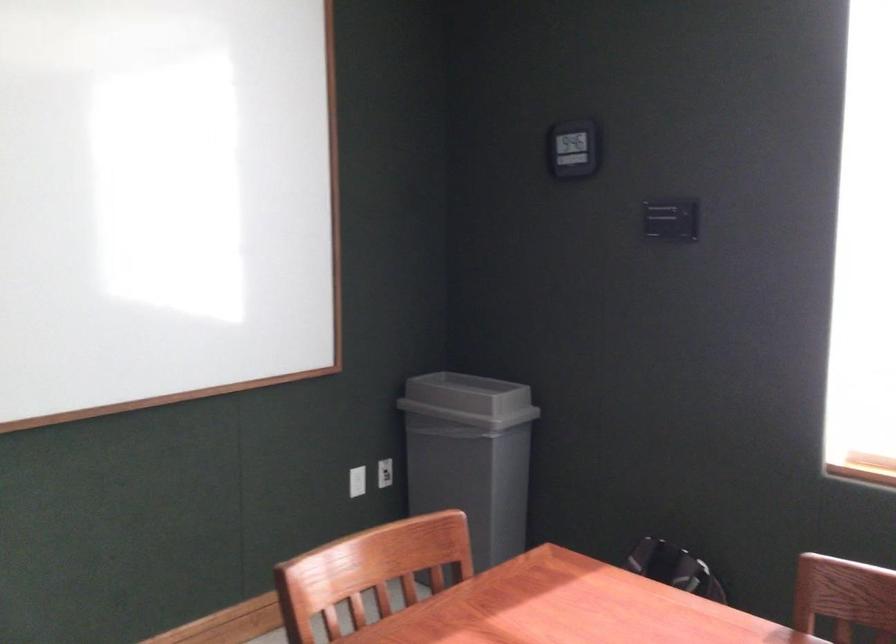
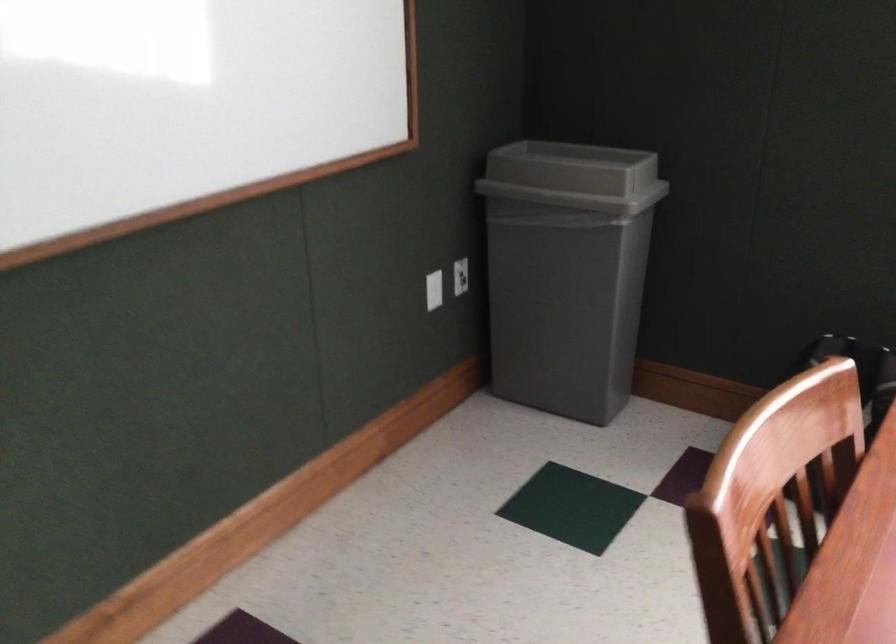
Question: Based on the continuous images, in which direction is the camera rotating? Reply with the corresponding letter.

Choices:
 (A) Left
 (B) Right
 (C) Up
 (D) Down

Answer: (D)